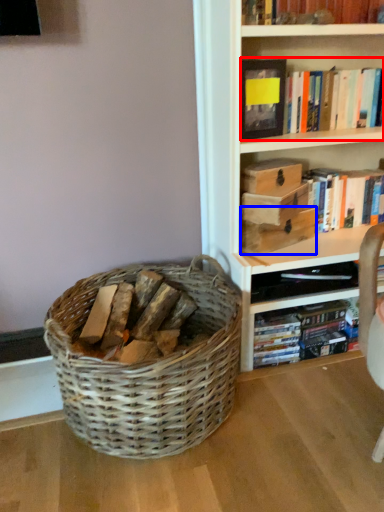
Question: Which object appears closest to the camera in this image, book (highlighted by a red box) or storage box (highlighted by a blue box)?

Choices:
 (A) book
 (B) storage box

Answer: (A)